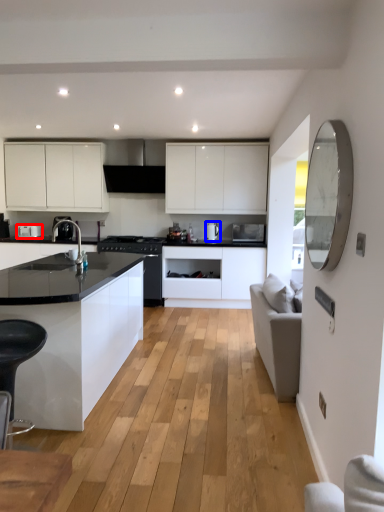
Question: Among these objects, which one is farthest to the camera, kitchen appliance (highlighted by a red box) or kitchen appliance (highlighted by a blue box)?

Choices:
 (A) kitchen appliance
 (B) kitchen appliance

Answer: (A)